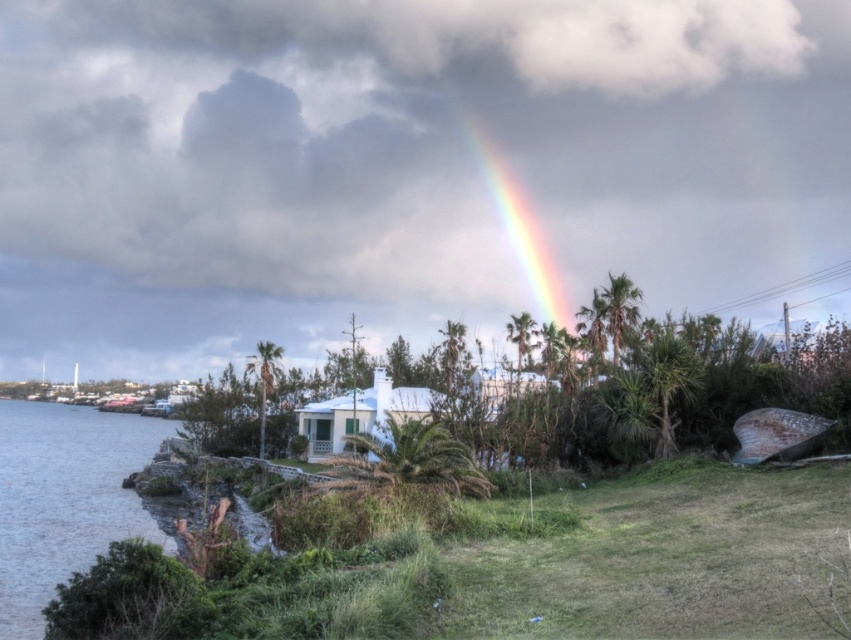
You are standing in the coastal scene and want to take a photo of both the clear water at lower left and the rainbow at upper center. Which object will occupy more space horizontally in your photo?

The clear water at lower left will occupy more space horizontally in the photo because its width is larger than the rainbow at upper center.